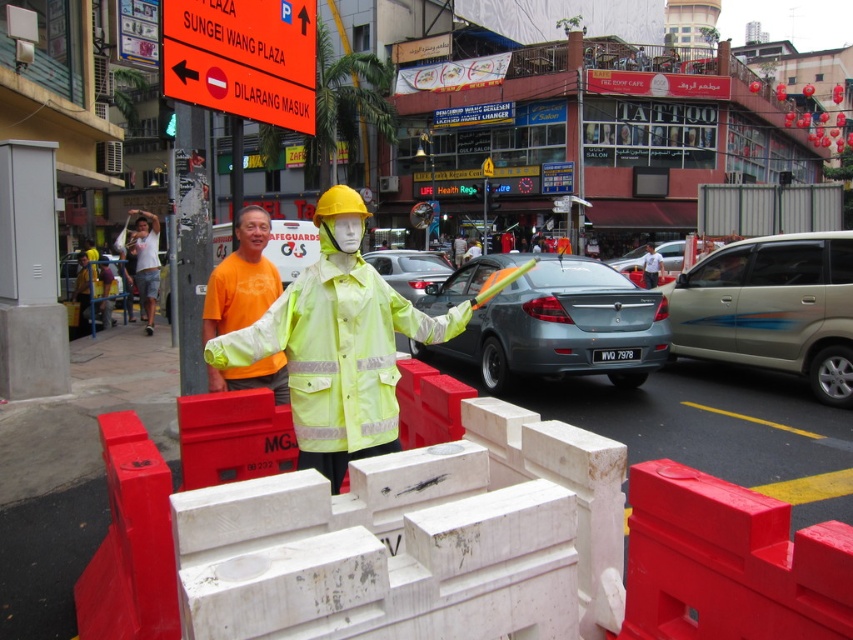
Question: Estimate the real-world distances between objects in this image. Which object is closer to the orange cotton shirt at center?

Choices:
 (A) gold metallic van at right
 (B) orange fabric shirt at center
 (C) metallic gray sedan at center
 (D) neon yellow reflective jacket at center

Answer: (D)

Question: Which point is farther from the camera taking this photo?

Choices:
 (A) (654, 260)
 (B) (218, 333)

Answer: (A)

Question: Is metallic gray sedan at center wider than gold metallic van at right?

Choices:
 (A) yes
 (B) no

Answer: (A)

Question: In this image, where is neon yellow reflective jacket at center located relative to gold metallic van at right?

Choices:
 (A) above
 (B) below

Answer: (B)

Question: Considering the real-world distances, which object is farthest from the gold metallic van at right?

Choices:
 (A) metallic silver sedan at center
 (B) matte gray sedan at center
 (C) white cotton t-shirt at left

Answer: (A)

Question: Is gold metallic van at right smaller than metallic silver sedan at center?

Choices:
 (A) no
 (B) yes

Answer: (B)